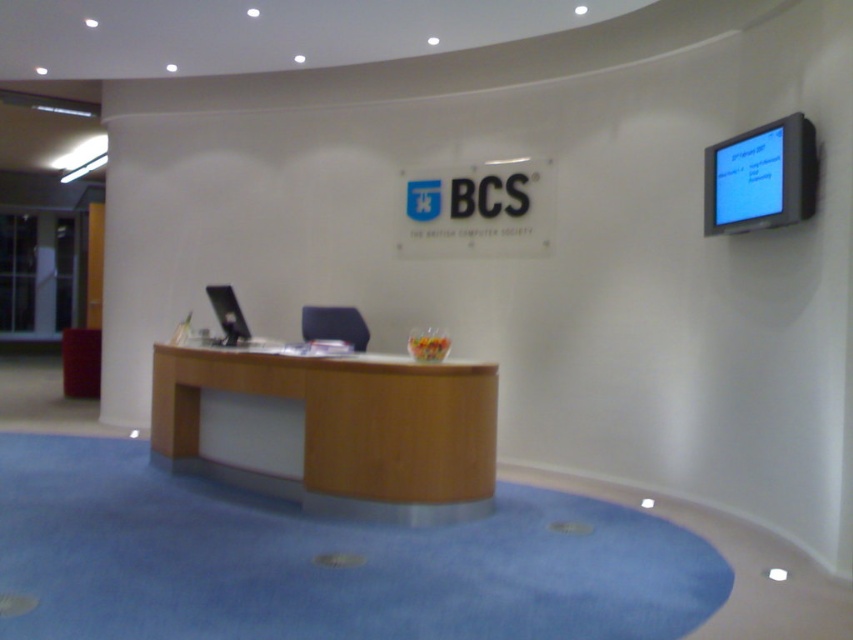
Question: Does woodendesk at center have a lesser width compared to white matte sign at center?

Choices:
 (A) no
 (B) yes

Answer: (A)

Question: Which of the following is the farthest from the observer?

Choices:
 (A) (422, 218)
 (B) (424, 388)

Answer: (A)

Question: Can you confirm if woodendesk at center is positioned below white matte sign at center?

Choices:
 (A) yes
 (B) no

Answer: (A)

Question: Which object is farther from the camera taking this photo?

Choices:
 (A) white matte sign at center
 (B) woodendesk at center

Answer: (A)

Question: Which point appears closest to the camera in this image?

Choices:
 (A) (419, 372)
 (B) (521, 192)

Answer: (A)

Question: Does woodendesk at center appear on the right side of white matte sign at center?

Choices:
 (A) yes
 (B) no

Answer: (B)